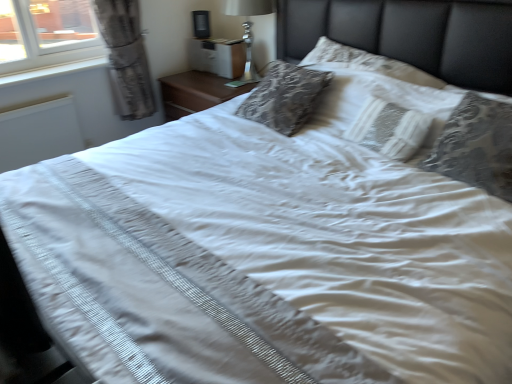
Question: From the image's perspective, is white matte radiator at left on silver metallic lamp at upper center?

Choices:
 (A) no
 (B) yes

Answer: (A)

Question: Is white matte radiator at left far away from silver metallic lamp at upper center?

Choices:
 (A) no
 (B) yes

Answer: (B)

Question: From a real-world perspective, does white matte radiator at left stand above silver metallic lamp at upper center?

Choices:
 (A) no
 (B) yes

Answer: (A)

Question: From the image's perspective, is white matte radiator at left beneath silver metallic lamp at upper center?

Choices:
 (A) yes
 (B) no

Answer: (A)

Question: Is white matte radiator at left at the right side of silver metallic lamp at upper center?

Choices:
 (A) no
 (B) yes

Answer: (A)

Question: From their relative heights in the image, would you say patterned fabric pillow at upper right, marked as the 2th pillow in a left-to-right arrangement, is taller or shorter than white matte radiator at left?

Choices:
 (A) tall
 (B) short

Answer: (A)

Question: Is point (470, 127) positioned closer to the camera than point (23, 150)?

Choices:
 (A) farther
 (B) closer

Answer: (B)

Question: From the image's perspective, relative to white matte radiator at left, is patterned fabric pillow at upper right, marked as the 2th pillow in a left-to-right arrangement, above or below?

Choices:
 (A) below
 (B) above

Answer: (A)

Question: From a real-world perspective, relative to white matte radiator at left, is patterned fabric pillow at upper right, which is counted as the first pillow, starting from the right, vertically above or below?

Choices:
 (A) above
 (B) below

Answer: (A)

Question: Do you think white lace pillow at center, the 2th pillow viewed from the right, is within white plastic window sill at left, or outside of it?

Choices:
 (A) outside
 (B) inside

Answer: (A)

Question: Based on their positions, is white lace pillow at center, which ranks as the 1th pillow in left-to-right order, located to the left or right of white plastic window sill at left?

Choices:
 (A) left
 (B) right

Answer: (B)

Question: Based on their sizes in the image, would you say white lace pillow at center, the 2th pillow viewed from the right, is bigger or smaller than white plastic window sill at left?

Choices:
 (A) small
 (B) big

Answer: (B)

Question: From a real-world perspective, is white lace pillow at center, which ranks as the 1th pillow in left-to-right order, positioned above or below white plastic window sill at left?

Choices:
 (A) above
 (B) below

Answer: (B)

Question: Relative to silver metallic lamp at upper center, is white plastic window sill at left in front or behind?

Choices:
 (A) front
 (B) behind

Answer: (A)

Question: From a real-world perspective, is white plastic window sill at left physically located above or below silver metallic lamp at upper center?

Choices:
 (A) above
 (B) below

Answer: (B)